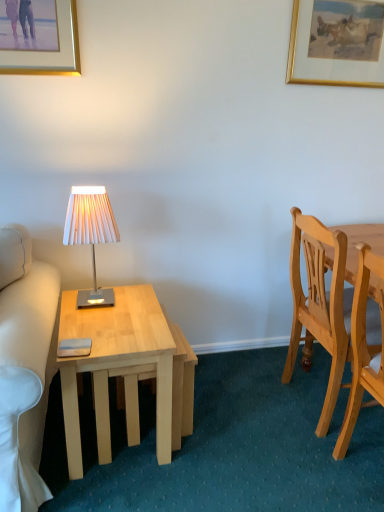
Image resolution: width=384 pixels, height=512 pixels. What do you see at coordinates (337, 42) in the screenshot? I see `gold/golden frame at upper right, marked as the 1th picture frame in a right-to-left arrangement` at bounding box center [337, 42].

Locate an element on the screen. The width and height of the screenshot is (384, 512). light wood chair at right, arranged as the first chair when viewed from the back is located at coordinates (320, 303).

What is the approximate height of light wood chair at right, the second chair positioned from the front?

light wood chair at right, the second chair positioned from the front, is 36.56 inches tall.

Measure the distance between point (x=40, y=31) and camera.

Point (x=40, y=31) is 5.57 feet from camera.

At what (x,y) coordinates should I click in order to perform the action: click on light wood desk at left. Please return your answer as a coordinate pair (x, y). This screenshot has height=512, width=384. Looking at the image, I should click on (116, 364).

Where is `gold/golden frame at upper right, which appears as the second picture frame when viewed from the front`? Image resolution: width=384 pixels, height=512 pixels. gold/golden frame at upper right, which appears as the second picture frame when viewed from the front is located at coordinates (337, 42).

Considering the relative sizes of white pleated fabric lampshade at left and light wood chair at right, which ranks as the first chair in front-to-back order, in the image provided, is white pleated fabric lampshade at left taller than light wood chair at right, which ranks as the first chair in front-to-back order,?

Incorrect, the height of white pleated fabric lampshade at left is not larger of that of light wood chair at right, which ranks as the first chair in front-to-back order.

From a real-world perspective, is white pleated fabric lampshade at left physically below light wood chair at right, which is counted as the 2th chair, starting from the back?

No, from a real-world perspective, white pleated fabric lampshade at left is not under light wood chair at right, which is counted as the 2th chair, starting from the back.

Is light wood chair at right, which ranks as the first chair in front-to-back order, inside white pleated fabric lampshade at left?

No, light wood chair at right, which ranks as the first chair in front-to-back order, is not a part of white pleated fabric lampshade at left.

From the image's perspective, which one is positioned higher, white pleated fabric lampshade at left or light wood chair at right, which ranks as the first chair in front-to-back order?

white pleated fabric lampshade at left.

Is point (372, 8) closer or farther from the camera than point (84, 186)?

Point (372, 8) appears to be farther away from the viewer than point (84, 186).

Which object is thinner, gold/golden frame at upper right, marked as the 1th picture frame in a right-to-left arrangement, or white pleated fabric lampshade at left?

Thinner between the two is gold/golden frame at upper right, marked as the 1th picture frame in a right-to-left arrangement.

Is gold/golden frame at upper right, acting as the 1th picture frame starting from the back, to the left or to the right of white pleated fabric lampshade at left in the image?

In the image, gold/golden frame at upper right, acting as the 1th picture frame starting from the back, appears on the right side of white pleated fabric lampshade at left.

Where is `desk to the left of light wood chair at right, arranged as the first chair when viewed from the back`? This screenshot has width=384, height=512. desk to the left of light wood chair at right, arranged as the first chair when viewed from the back is located at coordinates (116, 364).

Looking at this image, from the image's perspective, is light wood chair at right, arranged as the first chair when viewed from the back, under light wood desk at left?

No.

Would you say light wood chair at right, arranged as the first chair when viewed from the back, is inside or outside light wood desk at left?

light wood chair at right, arranged as the first chair when viewed from the back, exists outside the volume of light wood desk at left.

Could you measure the distance between light wood chair at right, arranged as the first chair when viewed from the back, and light wood desk at left?

light wood chair at right, arranged as the first chair when viewed from the back, and light wood desk at left are 75.39 centimeters apart from each other.

Is light wood chair at right, which ranks as the first chair in front-to-back order, smaller than gold-framed picture at upper left, which ranks as the 2th picture frame in right-to-left order?

Actually, light wood chair at right, which ranks as the first chair in front-to-back order, might be larger than gold-framed picture at upper left, which ranks as the 2th picture frame in right-to-left order.

Who is shorter, light wood chair at right, which is counted as the 2th chair, starting from the back, or gold-framed picture at upper left, which ranks as the 2th picture frame in right-to-left order?

gold-framed picture at upper left, which ranks as the 2th picture frame in right-to-left order, is shorter.

Between light wood chair at right, which is counted as the 2th chair, starting from the back, and gold-framed picture at upper left, which ranks as the 1th picture frame in front-to-back order, which one appears on the right side from the viewer's perspective?

light wood chair at right, which is counted as the 2th chair, starting from the back, is more to the right.

Does light wood chair at right, which ranks as the first chair in front-to-back order, lie in front of gold-framed picture at upper left, which ranks as the 1th picture frame in front-to-back order?

Yes, it is in front of gold-framed picture at upper left, which ranks as the 1th picture frame in front-to-back order.

Which object is thinner, light wood desk at left or light wood chair at right, which ranks as the first chair in front-to-back order?

With smaller width is light wood chair at right, which ranks as the first chair in front-to-back order.

Who is bigger, light wood desk at left or light wood chair at right, which is counted as the 2th chair, starting from the back?

light wood desk at left is bigger.

Which is in front, light wood desk at left or light wood chair at right, which is counted as the 2th chair, starting from the back?

Positioned in front is light wood chair at right, which is counted as the 2th chair, starting from the back.

Does gold-framed picture at upper left, which is the 2th picture frame from back to front, appear on the left side of white pleated fabric lampshade at left?

Yes.

Can you confirm if gold-framed picture at upper left, which is the 2th picture frame from back to front, is taller than white pleated fabric lampshade at left?

No.

Who is taller, white pleated fabric lampshade at left or gold-framed picture at upper left, which is the 2th picture frame from back to front?

With more height is white pleated fabric lampshade at left.

Is white pleated fabric lampshade at left oriented away from gold-framed picture at upper left, which ranks as the 1th picture frame in front-to-back order?

No.

Considering the positions of point (78, 298) and point (56, 27), is point (78, 298) closer or farther from the camera than point (56, 27)?

Point (78, 298) is farther from the camera than point (56, 27).

Where is `lamp lying on the right of gold-framed picture at upper left, which ranks as the 2th picture frame in right-to-left order`? Image resolution: width=384 pixels, height=512 pixels. lamp lying on the right of gold-framed picture at upper left, which ranks as the 2th picture frame in right-to-left order is located at coordinates (91, 233).

Where is `lamp behind the light wood chair at right, which ranks as the first chair in front-to-back order`? lamp behind the light wood chair at right, which ranks as the first chair in front-to-back order is located at coordinates (91, 233).

At what (x,y) coordinates should I click in order to perform the action: click on picture frame that appears on the right of white pleated fabric lampshade at left. Please return your answer as a coordinate pair (x, y). The image size is (384, 512). Looking at the image, I should click on (337, 42).

Based on the photo, based on their spatial positions, is light wood chair at right, the second chair positioned from the front, or gold-framed picture at upper left, which ranks as the 1th picture frame in front-to-back order, closer to white pleated fabric lampshade at left?

gold-framed picture at upper left, which ranks as the 1th picture frame in front-to-back order, is positioned closer to the anchor white pleated fabric lampshade at left.

Which object lies further to the anchor point light wood desk at left, gold-framed picture at upper left, which ranks as the 1th picture frame in front-to-back order, or white pleated fabric lampshade at left?

gold-framed picture at upper left, which ranks as the 1th picture frame in front-to-back order, is further to light wood desk at left.

From the image, which object appears to be farther from gold-framed picture at upper left, which ranks as the 2th picture frame in right-to-left order, light wood chair at right, which ranks as the first chair in front-to-back order, or white pleated fabric lampshade at left?

Among the two, light wood chair at right, which ranks as the first chair in front-to-back order, is located further to gold-framed picture at upper left, which ranks as the 2th picture frame in right-to-left order.

Considering their positions, is light wood chair at right, the second chair positioned from the front, positioned closer to light wood chair at right, which is counted as the 2th chair, starting from the back, than gold/golden frame at upper right, marked as the 1th picture frame in a right-to-left arrangement?

Among the two, light wood chair at right, the second chair positioned from the front, is located nearer to light wood chair at right, which is counted as the 2th chair, starting from the back.

Estimate the real-world distances between objects in this image. Which object is closer to gold-framed picture at upper left, which is the 1th picture frame in left-to-right order, light wood chair at right, the second chair positioned from the front, or white pleated fabric lampshade at left?

white pleated fabric lampshade at left.

Estimate the real-world distances between objects in this image. Which object is further from light wood chair at right, which ranks as the first chair in front-to-back order, gold/golden frame at upper right, marked as the 1th picture frame in a right-to-left arrangement, or gold-framed picture at upper left, which ranks as the 2th picture frame in right-to-left order?

gold-framed picture at upper left, which ranks as the 2th picture frame in right-to-left order, lies further to light wood chair at right, which ranks as the first chair in front-to-back order, than the other object.

Looking at this image, from the image, which object appears to be nearer to light wood chair at right, which is counted as the 2th chair, starting from the back, gold-framed picture at upper left, which ranks as the 2th picture frame in right-to-left order, or light wood chair at right, arranged as the first chair when viewed from the back?

light wood chair at right, arranged as the first chair when viewed from the back, is positioned closer to the anchor light wood chair at right, which is counted as the 2th chair, starting from the back.

Estimate the real-world distances between objects in this image. Which object is closer to gold/golden frame at upper right, acting as the 1th picture frame starting from the back, light wood chair at right, the second chair positioned from the front, or light wood chair at right, which ranks as the first chair in front-to-back order?

The object closer to gold/golden frame at upper right, acting as the 1th picture frame starting from the back, is light wood chair at right, the second chair positioned from the front.

This screenshot has height=512, width=384. What are the coordinates of `desk located between white pleated fabric lampshade at left and light wood chair at right, arranged as the first chair when viewed from the back, in the left-right direction` in the screenshot? It's located at (116, 364).

The height and width of the screenshot is (512, 384). Identify the location of picture frame that lies between gold/golden frame at upper right, the second picture frame viewed from the left, and light wood chair at right, which ranks as the first chair in front-to-back order, from top to bottom. (39, 37).

Identify the location of lamp between gold/golden frame at upper right, marked as the 1th picture frame in a right-to-left arrangement, and light wood chair at right, arranged as the first chair when viewed from the back, in the vertical direction. (91, 233).

Identify the location of chair between gold/golden frame at upper right, the second picture frame viewed from the left, and light wood chair at right, which ranks as the first chair in front-to-back order, in the up-down direction. (320, 303).